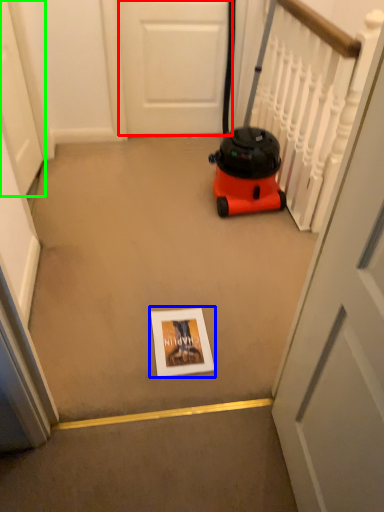
Question: Which object is the farthest from door (highlighted by a red box)? Choose among these: copy (highlighted by a blue box) or door (highlighted by a green box).

Choices:
 (A) copy
 (B) door

Answer: (A)